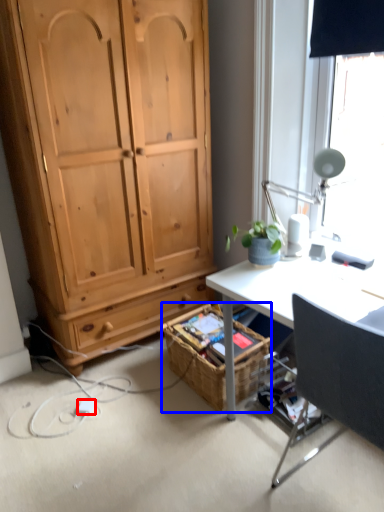
Question: Which object is closer to the camera taking this photo, power outlet (highlighted by a red box) or picnic basket (highlighted by a blue box)?

Choices:
 (A) power outlet
 (B) picnic basket

Answer: (B)